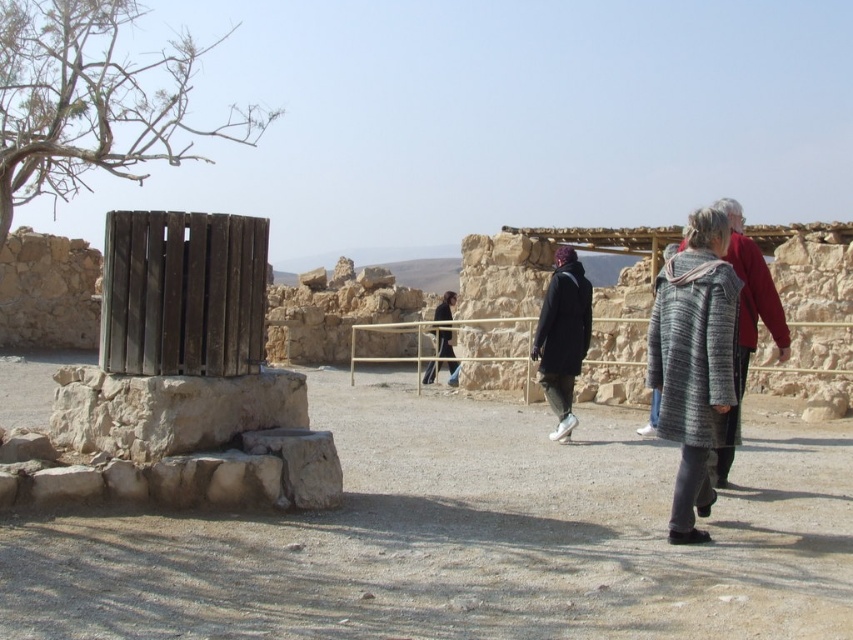
Question: Where is gray wool coat at center right located in relation to dark brown leather jacket at center in the image?

Choices:
 (A) right
 (B) left

Answer: (A)

Question: Among these points, which one is farthest from the camera?

Choices:
 (A) (180, 634)
 (B) (670, 300)
 (C) (293, 387)

Answer: (C)

Question: Which point appears closest to the camera in this image?

Choices:
 (A) pos(94,435)
 (B) pos(447,316)
 (C) pos(691,266)

Answer: (C)

Question: Considering the relative positions of gray wool coat at center right and dark brown leather jacket at center in the image provided, where is gray wool coat at center right located with respect to dark brown leather jacket at center?

Choices:
 (A) right
 (B) left

Answer: (A)

Question: Does gray wool coat at center right appear under natural stone wall at lower left?

Choices:
 (A) yes
 (B) no

Answer: (B)

Question: Among these objects, which one is nearest to the camera?

Choices:
 (A) dirt field at center
 (B) gray wool coat at center right

Answer: (A)